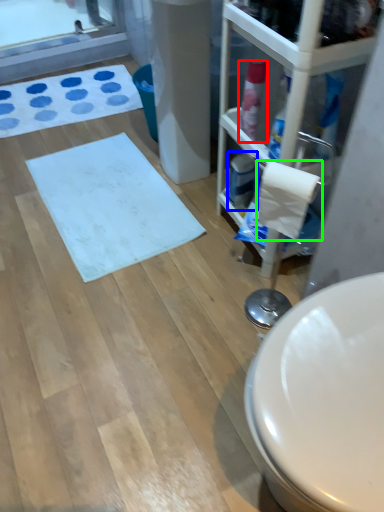
Question: Estimate the real-world distances between objects in this image. Which object is farther from cleaning product (highlighted by a red box), cleaning product (highlighted by a blue box) or toilet paper (highlighted by a green box)?

Choices:
 (A) cleaning product
 (B) toilet paper

Answer: (B)